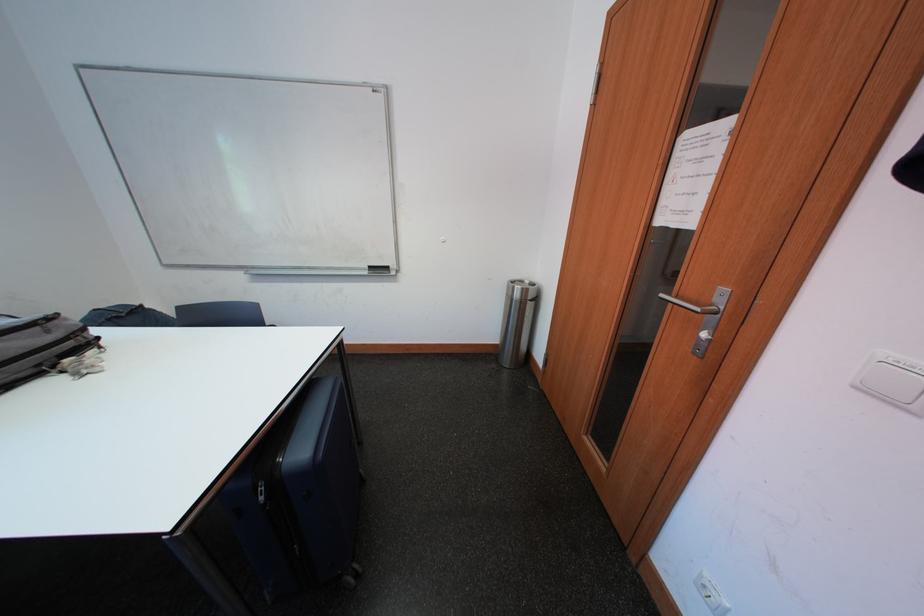
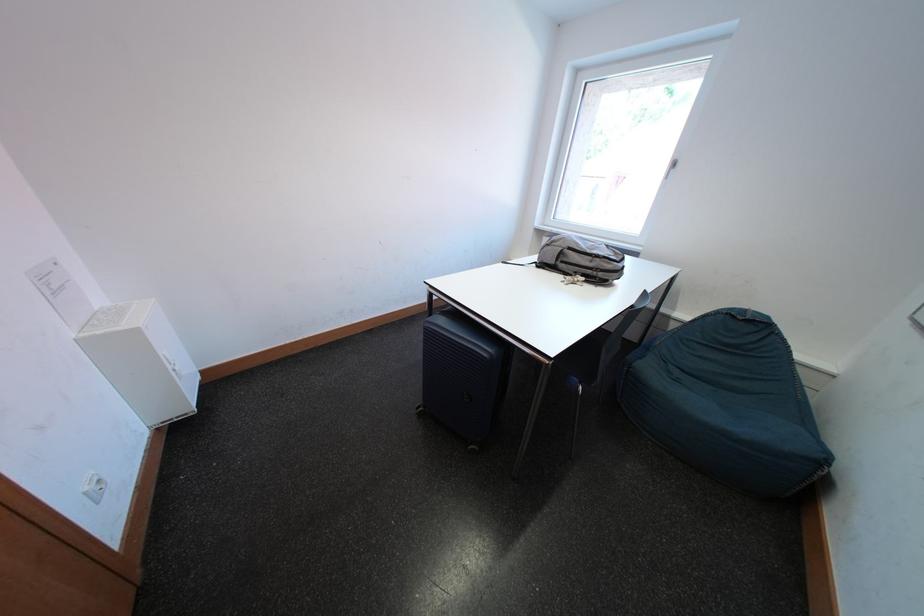
The point at (58, 334) is marked in the first image. Where is the corresponding point in the second image?

(601, 265)